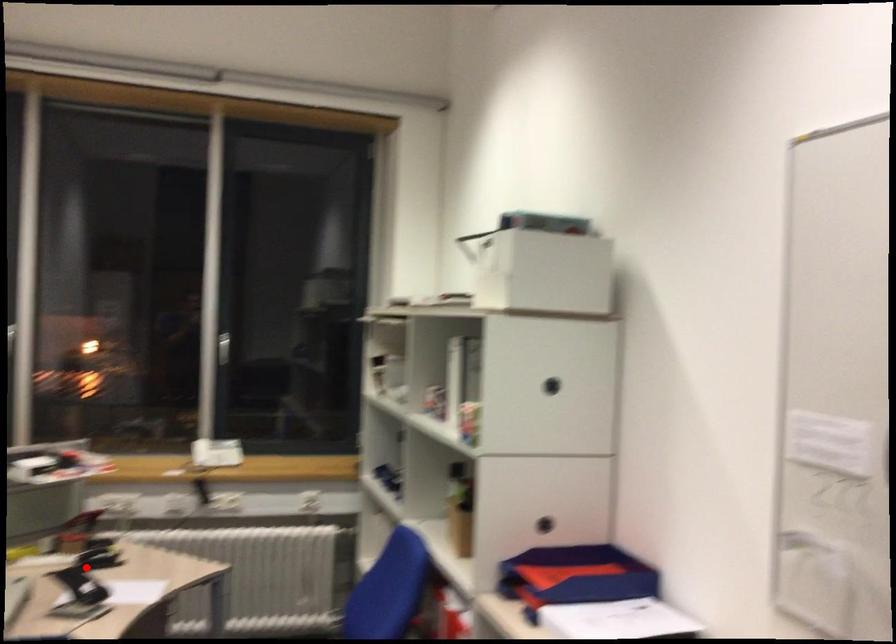
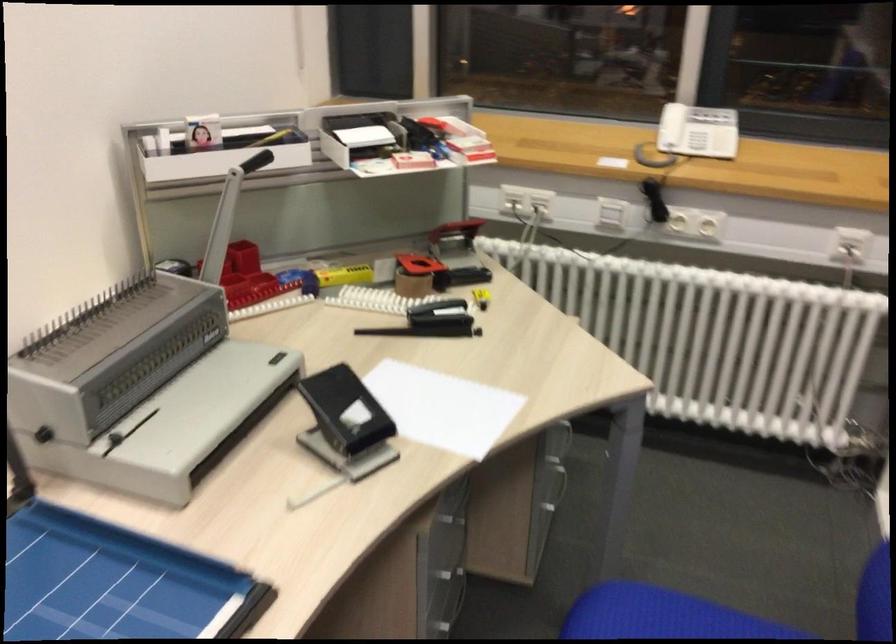
In the second image, find the point that corresponds to the highlighted location in the first image.

(431, 321)